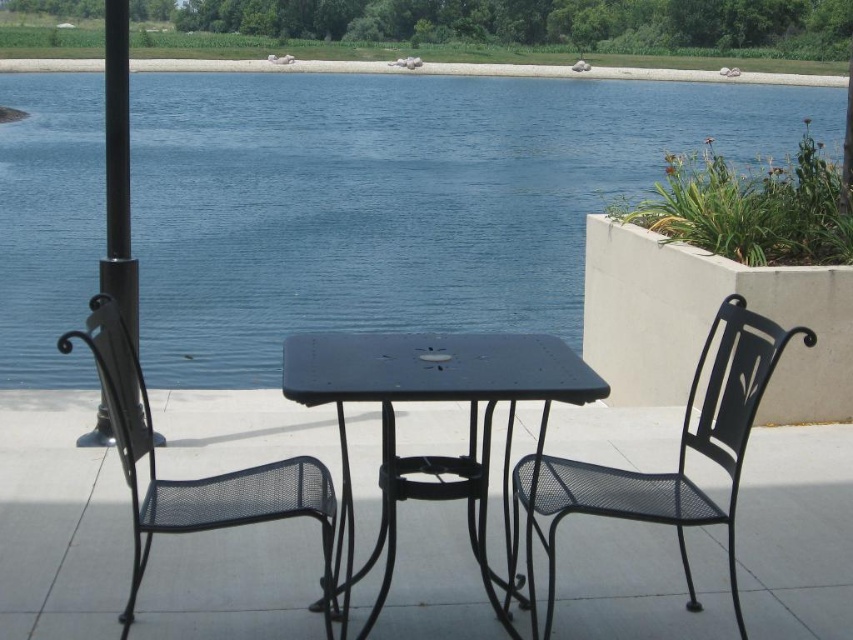
Question: Can you confirm if black mesh chair at right is positioned to the left of black metal pole at left?

Choices:
 (A) no
 (B) yes

Answer: (A)

Question: Does black mesh chair at right have a smaller size compared to black mesh chair at left?

Choices:
 (A) no
 (B) yes

Answer: (B)

Question: Does blue water at center have a smaller size compared to black wrought iron table at center?

Choices:
 (A) yes
 (B) no

Answer: (B)

Question: Which object is closer to the camera taking this photo?

Choices:
 (A) blue water at center
 (B) black metal pole at left
 (C) black mesh chair at left
 (D) black wrought iron table at center

Answer: (D)

Question: Which object is the closest to the black mesh chair at left?

Choices:
 (A) black wrought iron table at center
 (B) blue water at center
 (C) black metal pole at left
 (D) black mesh chair at right

Answer: (A)

Question: Considering the real-world distances, which object is closest to the black wrought iron table at center?

Choices:
 (A) black metal pole at left
 (B) blue water at center

Answer: (A)